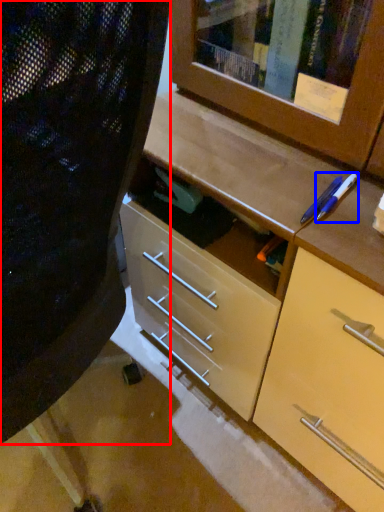
Question: Which object is closer to the camera taking this photo, folding chair (highlighted by a red box) or pencil (highlighted by a blue box)?

Choices:
 (A) folding chair
 (B) pencil

Answer: (A)